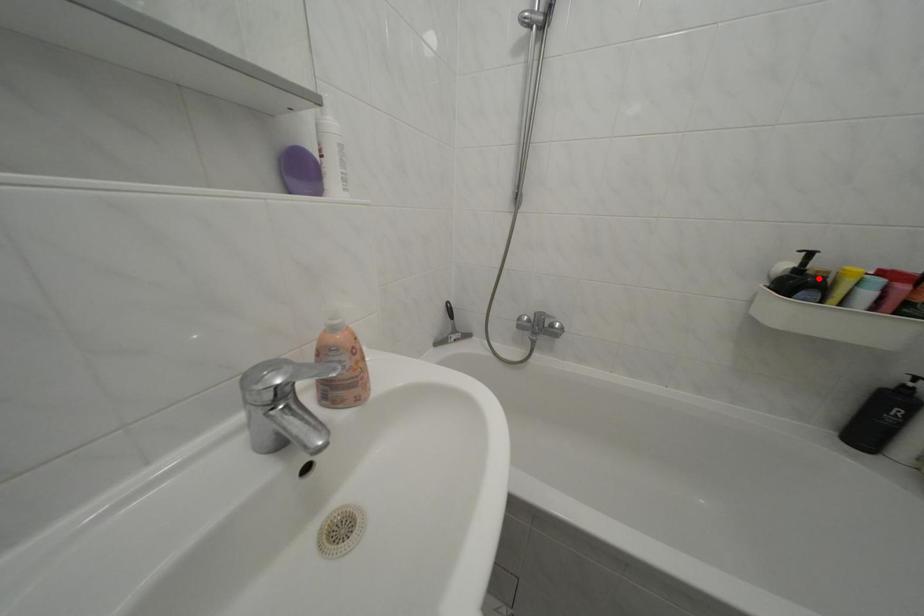
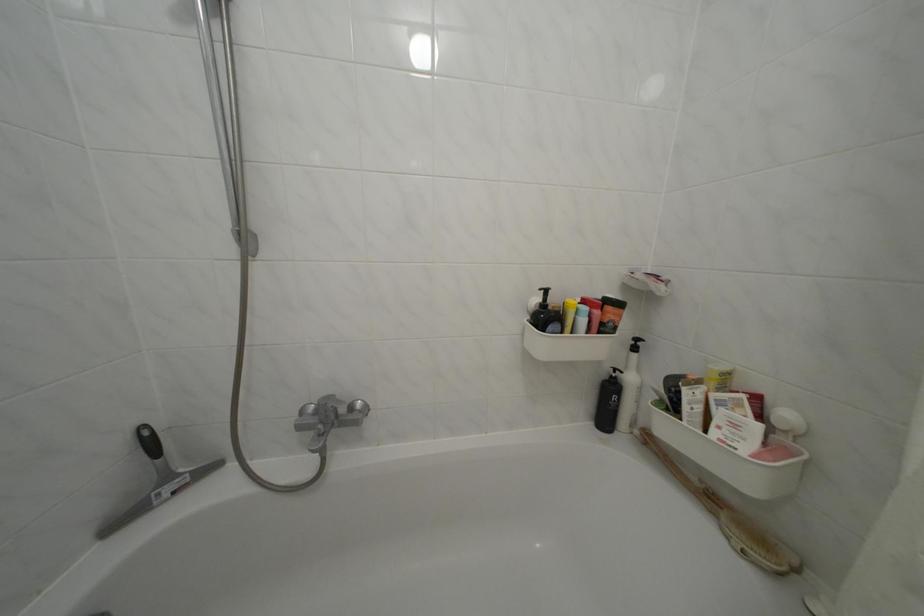
The point at the highlighted location is marked in the first image. Where is the corresponding point in the second image?

(560, 314)